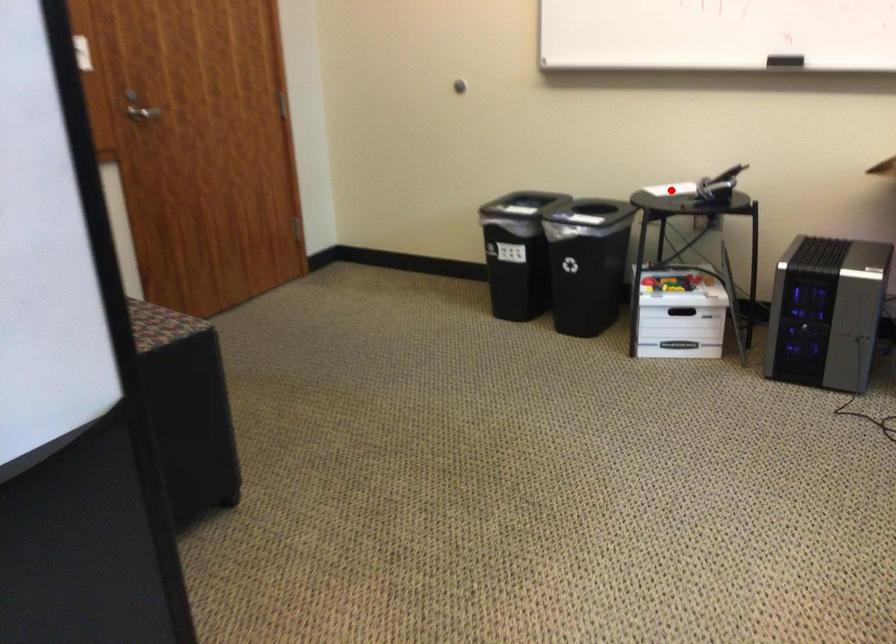
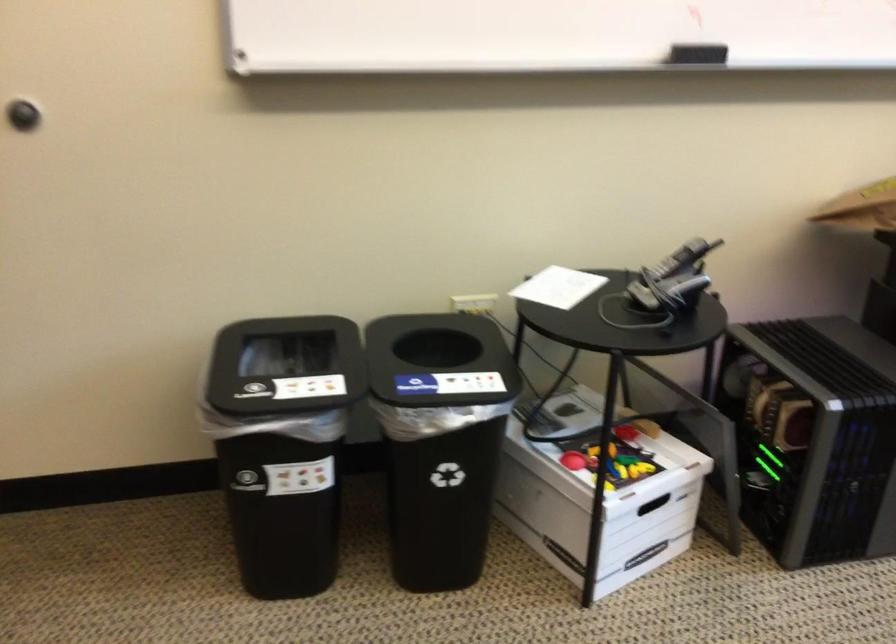
Question: I am providing you with two images of the same scene from different viewpoints. Image1 has a red point marked. In image2, the corresponding 3D location appears at what relative position? Reply with the corresponding letter.

Choices:
 (A) Closer
 (B) Farther

Answer: (A)